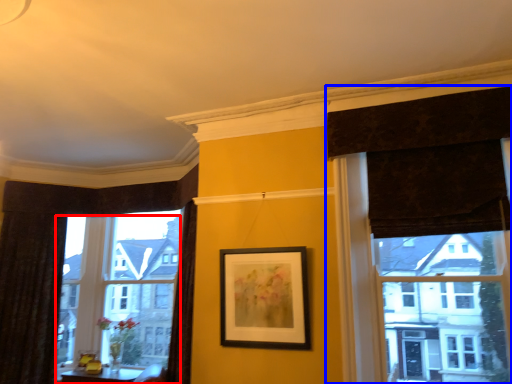
Question: Among these objects, which one is nearest to the camera, window (highlighted by a red box) or curtain (highlighted by a blue box)?

Choices:
 (A) window
 (B) curtain

Answer: (B)